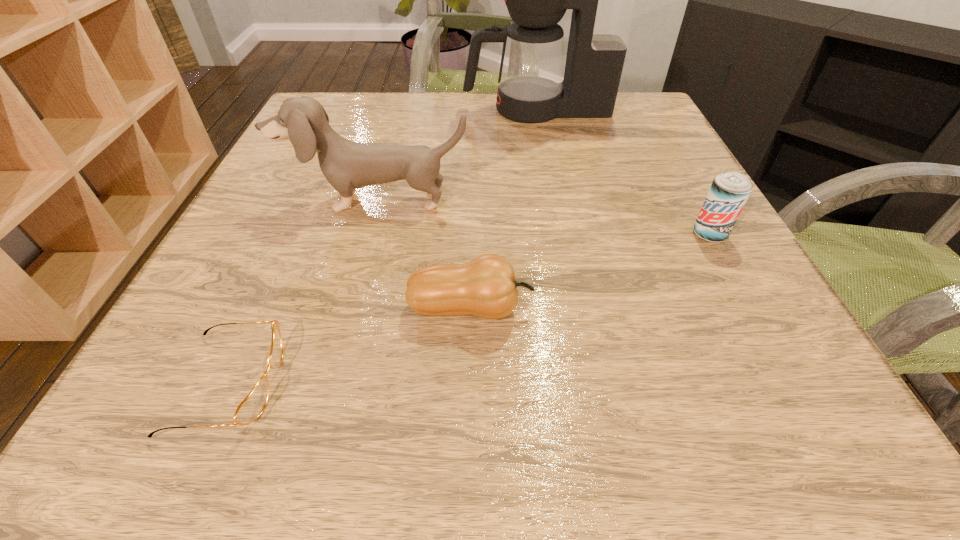
Locate an element on the screen. free spot that satisfies the following two spatial constraints: 1. pour from the carafe of the farthest object; 2. on the right side of the beer can is located at coordinates (561, 234).

At what (x,y) coordinates should I click in order to perform the action: click on vacant position in the image that satisfies the following two spatial constraints: 1. pour from the carafe of the farthest object; 2. at the face of the second farthest object. Please return your answer as a coordinate pair (x, y). Looking at the image, I should click on (555, 201).